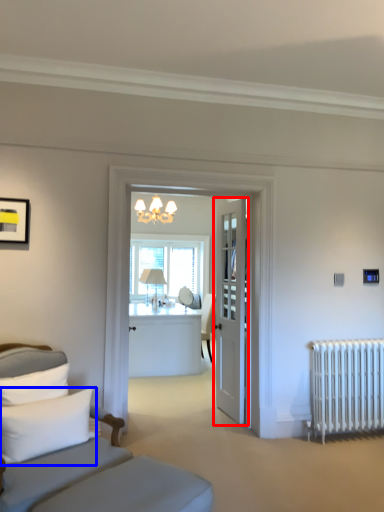
Question: Which point is further to the camera, door (highlighted by a red box) or pillow (highlighted by a blue box)?

Choices:
 (A) door
 (B) pillow

Answer: (A)